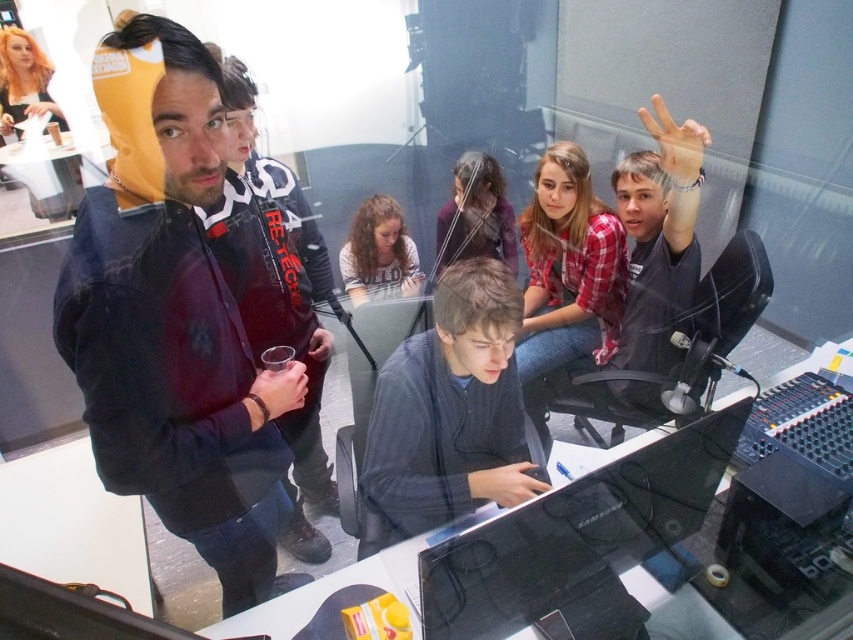
You are planning to place a large rectangular box on the transparent glass table at center. Considering the blonde hair at upper left is also present in the scene, can you determine if the table is wide enough to accommodate the box without overlapping the hair?

The transparent glass table at center is wider than the blonde hair at upper left, so it should be wide enough to place the box without overlapping the hair.

Looking at the people in the recording studio, which individual has hair with a smaller width between curly hair at center and blonde hair at upper left?

The curly hair at center has a smaller width compared to the blonde hair at upper left.

Looking at the people in the recording studio, which individual has shorter hair between the dark brown hair at center and curly hair at center?

The dark brown hair at center is shorter than the curly hair at center.